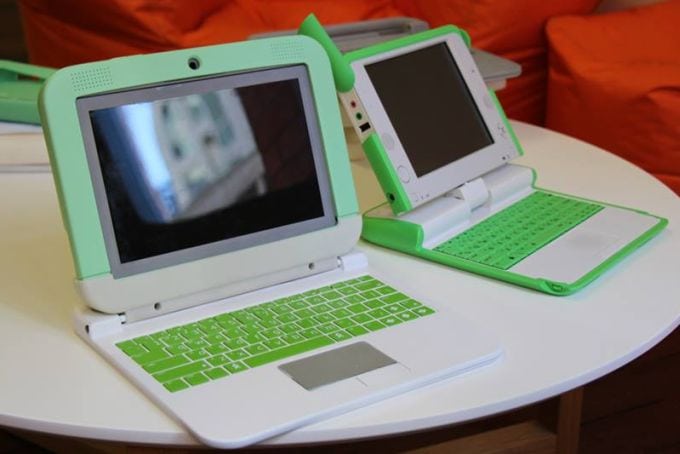
Image resolution: width=680 pixels, height=454 pixels. Find the location of `toy laptop`. toy laptop is located at coordinates (273, 287), (477, 206).